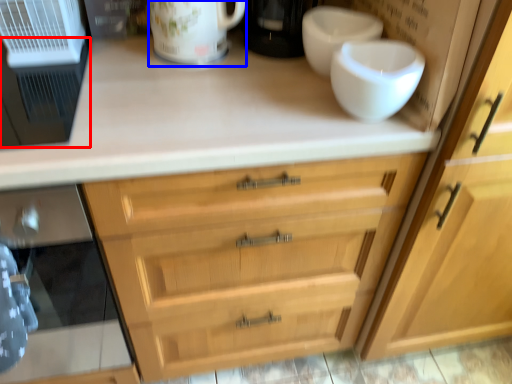
Question: Which point is closer to the camera, appliance (highlighted by a red box) or mug (highlighted by a blue box)?

Choices:
 (A) appliance
 (B) mug

Answer: (A)